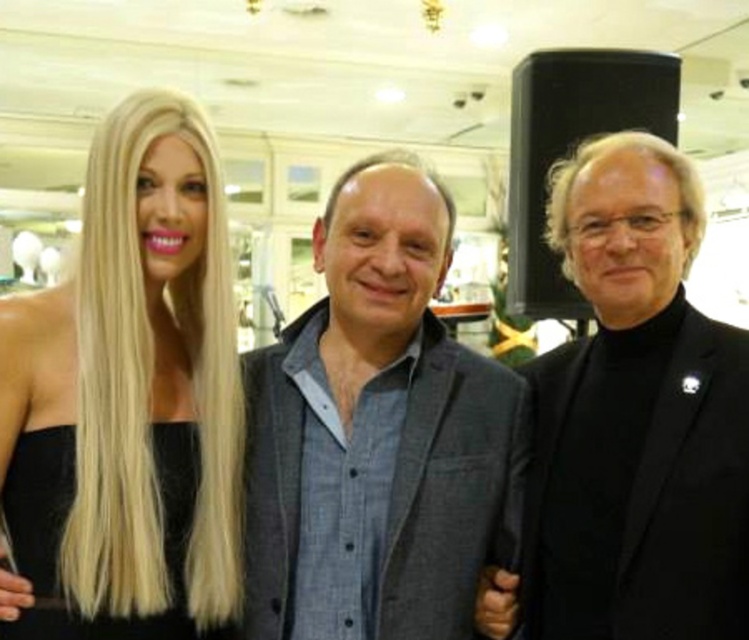
You are a photographer adjusting the focus on your camera. You need to ensure that both the gray textured blazer at center and the blonde hair at left are in focus. Which object should you focus on first to ensure both are sharp?

The gray textured blazer at center is bigger than the blonde hair at left, so focusing on the larger object first will help ensure both are in focus.